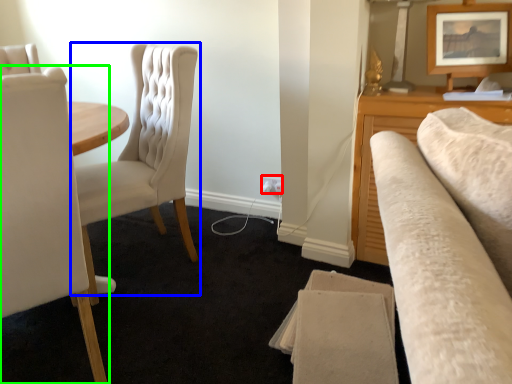
Question: Which object is positioned closest to electric outlet (highlighted by a red box)? Select from chair (highlighted by a blue box) and chair (highlighted by a green box).

Choices:
 (A) chair
 (B) chair

Answer: (A)